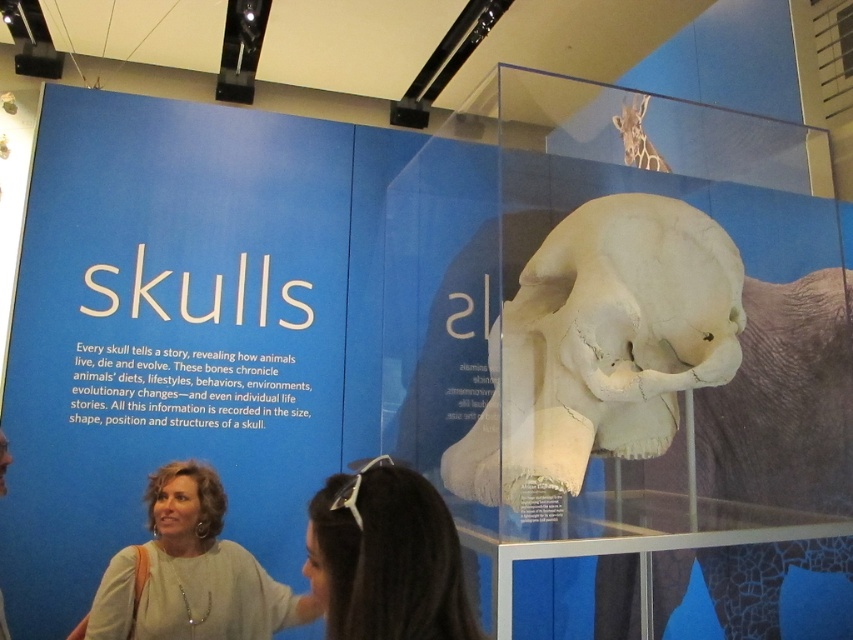
Question: Which of the following is the farthest from the observer?

Choices:
 (A) tap(96, 593)
 (B) tap(415, 554)
 (C) tap(506, 353)

Answer: (A)

Question: Which object appears farthest from the camera in this image?

Choices:
 (A) dark brown hair at lower center
 (B) white matte skull at center
 (C) light beige sweater at lower left

Answer: (C)

Question: Does white matte skull at center have a greater width compared to dark brown hair at lower center?

Choices:
 (A) yes
 (B) no

Answer: (A)

Question: Is white matte skull at center thinner than light beige sweater at lower left?

Choices:
 (A) yes
 (B) no

Answer: (B)

Question: Is the position of white matte skull at center more distant than that of dark brown hair at lower center?

Choices:
 (A) no
 (B) yes

Answer: (B)

Question: Which of these objects is positioned closest to the light beige sweater at lower left?

Choices:
 (A) dark brown hair at lower center
 (B) white matte skull at center

Answer: (B)